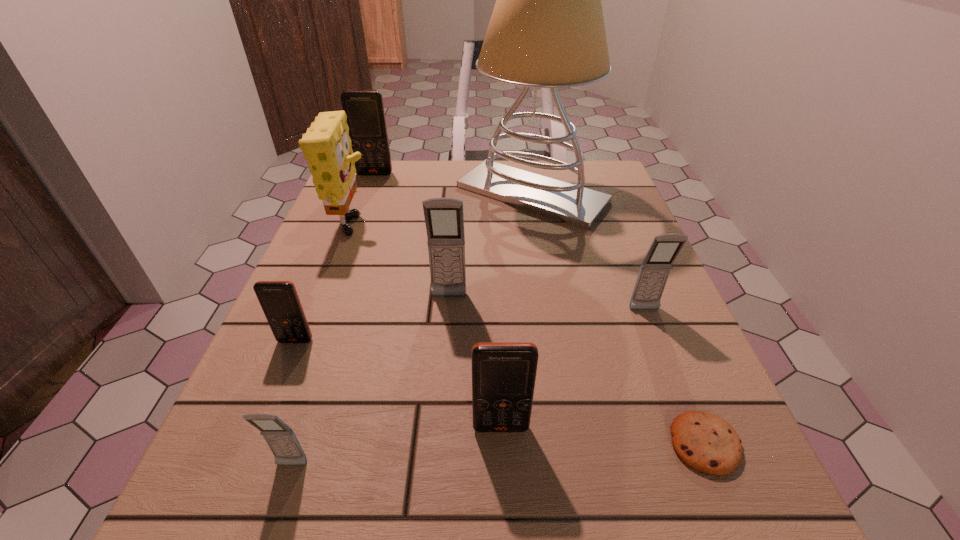
Where is `the tallest object`? This screenshot has width=960, height=540. the tallest object is located at coordinates (547, 30).

What are the coordinates of `table lamp` in the screenshot? It's located at (547, 30).

At what (x,y) coordinates should I click in order to perform the action: click on yellow sponge. Please return your answer as a coordinate pair (x, y). This screenshot has height=540, width=960. Looking at the image, I should click on (326, 145).

This screenshot has height=540, width=960. Find the location of `the second gray cellular telephone from right to left`. the second gray cellular telephone from right to left is located at coordinates (444, 217).

Find the location of a particular element. This screenshot has width=960, height=540. the biggest gray cellular telephone is located at coordinates (444, 217).

Identify the location of the biggest orange cellular telephone. (365, 113).

This screenshot has height=540, width=960. I want to click on the farthest orange cellular telephone, so click(x=365, y=113).

At what (x,y) coordinates should I click in order to perform the action: click on the fourth nearest cellular telephone. Please return your answer as a coordinate pair (x, y). The height and width of the screenshot is (540, 960). Looking at the image, I should click on (655, 269).

You are a GUI agent. You are given a task and a screenshot of the screen. Output one action in this format:
    pyautogui.click(x=<x>, y=<y>)
    Task: Click on the rightmost cellular telephone
    
    Given the screenshot: What is the action you would take?
    pyautogui.click(x=655, y=269)

You are a GUI agent. You are given a task and a screenshot of the screen. Output one action in this format:
    pyautogui.click(x=<x>, y=<y>)
    Task: Click on the rightmost orange cellular telephone
    The height and width of the screenshot is (540, 960).
    Given the screenshot: What is the action you would take?
    pyautogui.click(x=503, y=373)